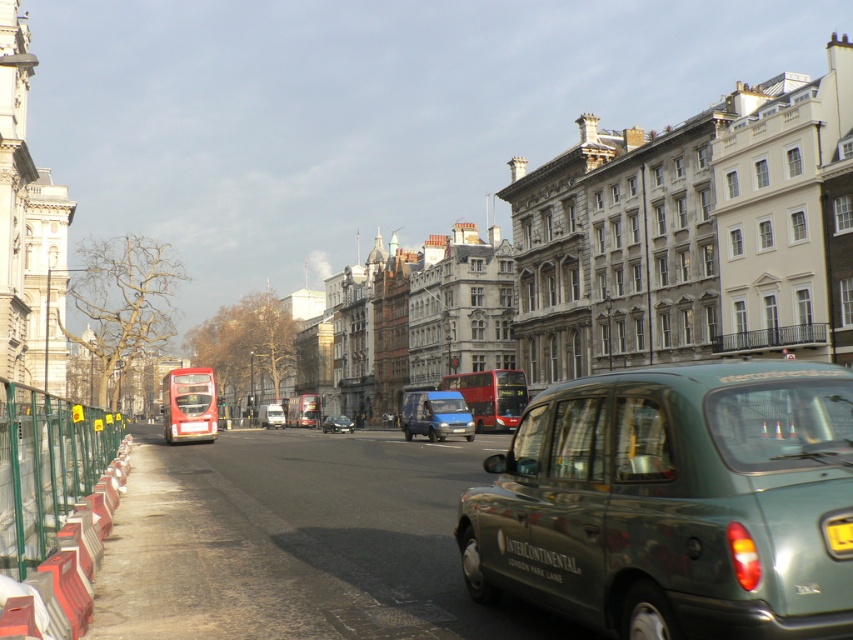
Is green matte taxi at center further to camera compared to red plastic barrier at left?

That is False.

Looking at this image, which is more to the left, green matte taxi at center or red plastic barrier at left?

red plastic barrier at left is more to the left.

What do you see at coordinates (672, 502) in the screenshot? I see `green matte taxi at center` at bounding box center [672, 502].

Locate an element on the screen. green matte taxi at center is located at coordinates (672, 502).

Is green matte taxi at center above metallic blue van at center?

Indeed, green matte taxi at center is positioned over metallic blue van at center.

Can you confirm if green matte taxi at center is bigger than metallic blue van at center?

Incorrect, green matte taxi at center is not larger than metallic blue van at center.

At what (x,y) coordinates should I click in order to perform the action: click on green matte taxi at center. Please return your answer as a coordinate pair (x, y). The image size is (853, 640). Looking at the image, I should click on (672, 502).

Image resolution: width=853 pixels, height=640 pixels. What do you see at coordinates (433, 413) in the screenshot?
I see `matte blue van at center` at bounding box center [433, 413].

Who is shorter, matte blue van at center or metallic blue van at center?

metallic blue van at center

Which is behind, point (410, 419) or point (262, 422)?

Point (262, 422)

This screenshot has height=640, width=853. I want to click on matte blue van at center, so click(x=433, y=413).